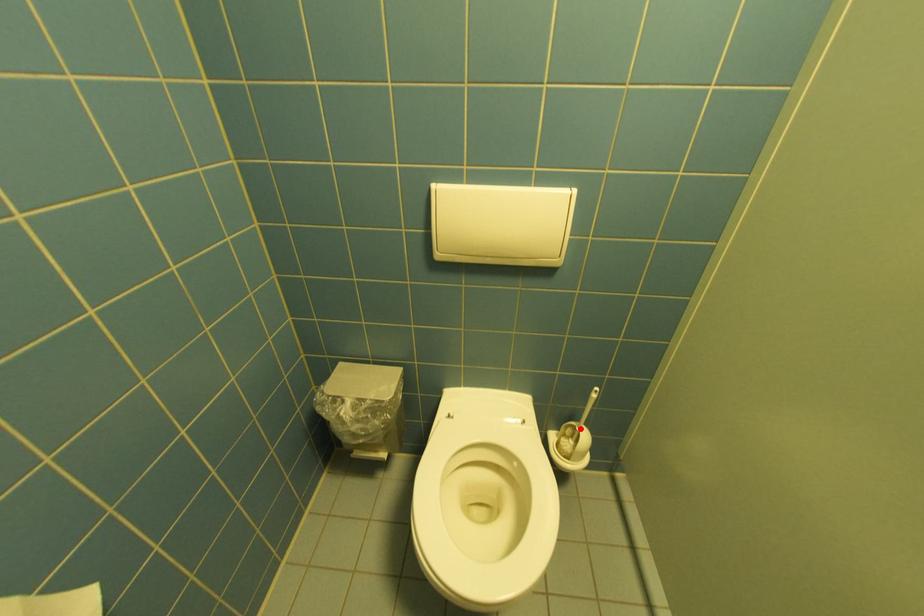
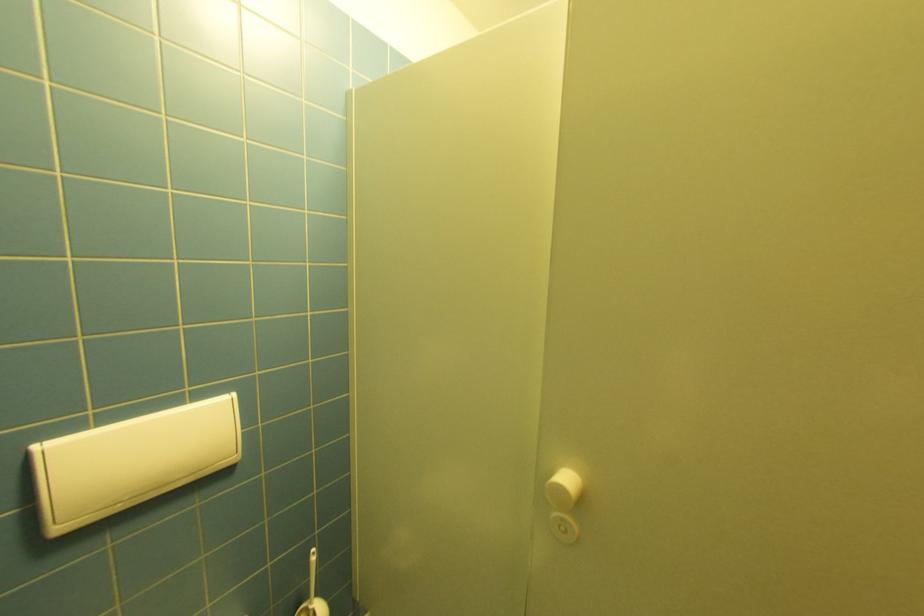
Locate, in the second image, the point that corresponds to the highlighted location in the first image.

(312, 610)